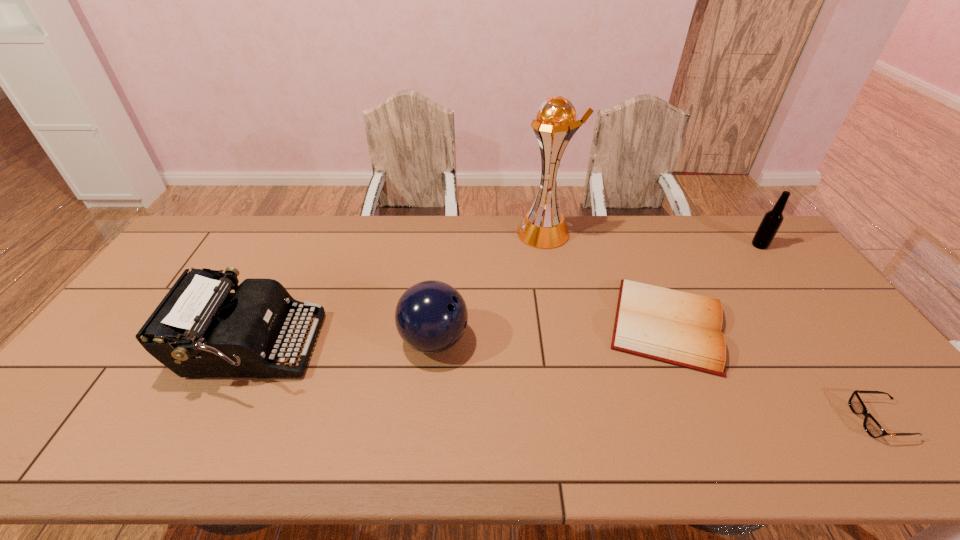
Identify the location of the fourth object from right to left. This screenshot has width=960, height=540. 544,227.

Find the location of a particular element. This screenshot has height=540, width=960. the tallest object is located at coordinates (544, 227).

Where is `beer bottle`? The image size is (960, 540). beer bottle is located at coordinates (772, 220).

This screenshot has width=960, height=540. I want to click on the fifth object from right to left, so click(x=431, y=316).

Identify the location of typewriter. The image size is (960, 540). (200, 329).

Image resolution: width=960 pixels, height=540 pixels. Identify the location of the third object from right to left. (685, 329).

The width and height of the screenshot is (960, 540). Identify the location of sunglasses. (873, 428).

At what (x,y) coordinates should I click in order to perform the action: click on vacant space located on the front-facing side of the tallest object. Please return your answer as a coordinate pair (x, y). The height and width of the screenshot is (540, 960). Looking at the image, I should click on (465, 233).

Identify the location of free space located on the front-facing side of the tallest object. The width and height of the screenshot is (960, 540). (456, 233).

Locate an element on the screen. free space located 0.130m on the front-facing side of the tallest object is located at coordinates (481, 233).